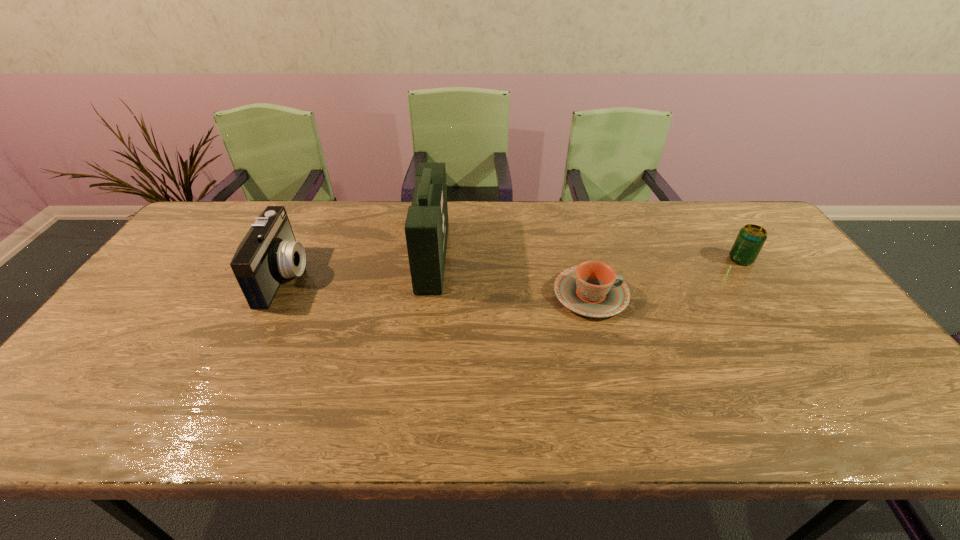
At what (x,y) coordinates should I click in order to perform the action: click on vacant space that is in between the shortest object and the first-aid kit. Please return your answer as a coordinate pair (x, y). Image resolution: width=960 pixels, height=540 pixels. Looking at the image, I should click on (512, 275).

The image size is (960, 540). I want to click on vacant space that's between the shortest object and the third tallest object, so click(x=666, y=277).

I want to click on vacant space that's between the third shortest object and the third object from right to left, so click(x=359, y=266).

This screenshot has width=960, height=540. In order to click on vacant region between the third shortest object and the beer can in this screenshot , I will do `click(513, 268)`.

Where is `free spot between the camcorder and the second object from left to right`? This screenshot has height=540, width=960. free spot between the camcorder and the second object from left to right is located at coordinates (359, 266).

This screenshot has width=960, height=540. In order to click on vacant area that lies between the rightmost object and the third shortest object in this screenshot , I will do `click(513, 268)`.

Point out which object is positioned as the second nearest to the leftmost object. Please provide its 2D coordinates. Your answer should be formatted as a tuple, i.e. [(x, y)], where the tuple contains the x and y coordinates of a point satisfying the conditions above.

[(592, 289)]

Where is `object that is the third closest to the third tallest object`? The height and width of the screenshot is (540, 960). object that is the third closest to the third tallest object is located at coordinates (269, 252).

At what (x,y) coordinates should I click in order to perform the action: click on vacant space that satisfies the following two spatial constraints: 1. on the back side of the beer can; 2. on the front-facing side of the tallest object. Please return your answer as a coordinate pair (x, y). The width and height of the screenshot is (960, 540). Looking at the image, I should click on (739, 257).

You are a GUI agent. You are given a task and a screenshot of the screen. Output one action in this format:
    pyautogui.click(x=<x>, y=<y>)
    Task: Click on the vacant position in the image that satisfies the following two spatial constraints: 1. on the front side of the beer can; 2. on the handle side of the chinaware
    Image resolution: width=960 pixels, height=540 pixels.
    Given the screenshot: What is the action you would take?
    pyautogui.click(x=765, y=294)